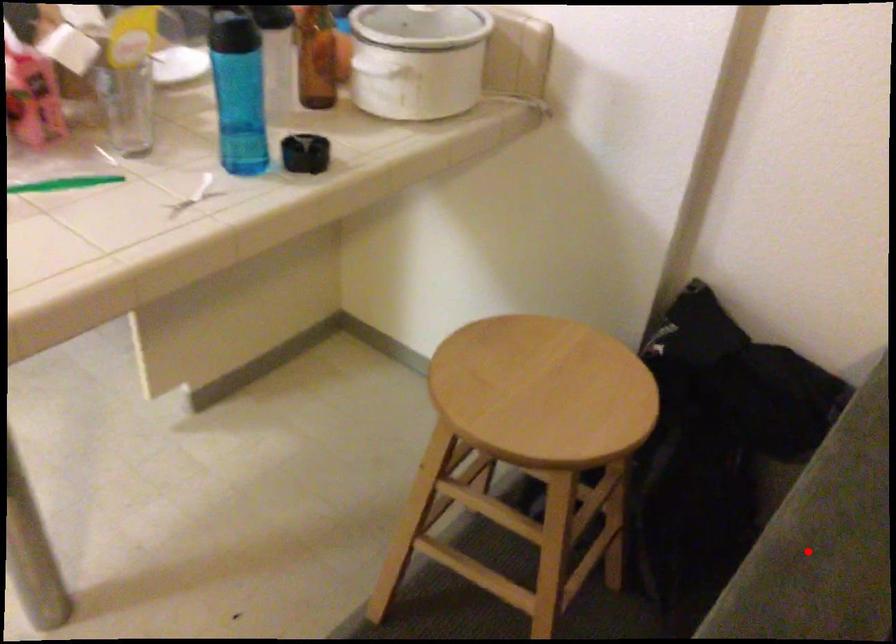
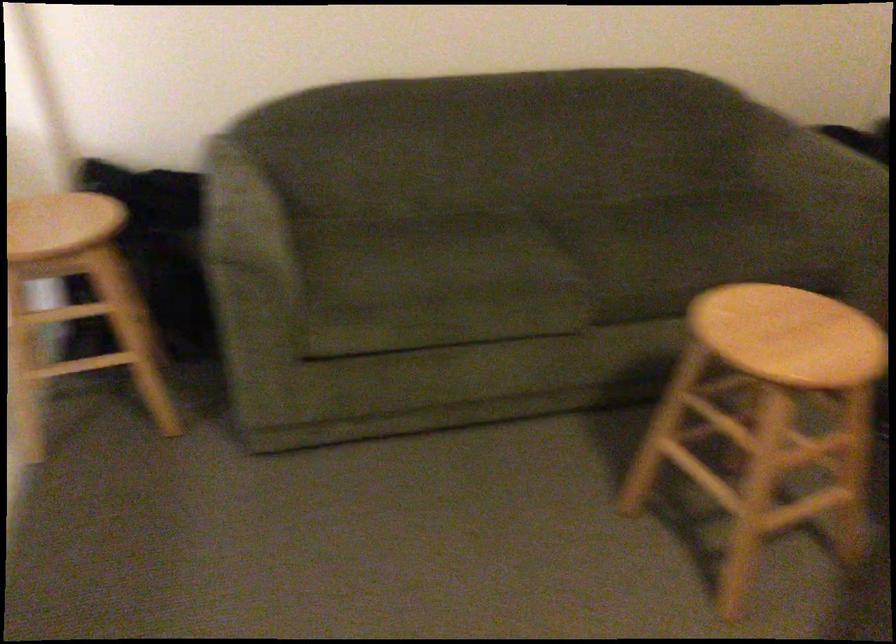
Find the pixel in the second image that matches the highlighted location in the first image.

(236, 210)